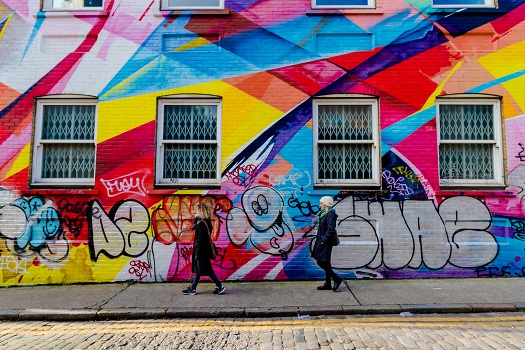
The width and height of the screenshot is (525, 350). Find the location of `top window pane`. top window pane is located at coordinates (74, 118), (192, 115), (332, 125), (462, 121).